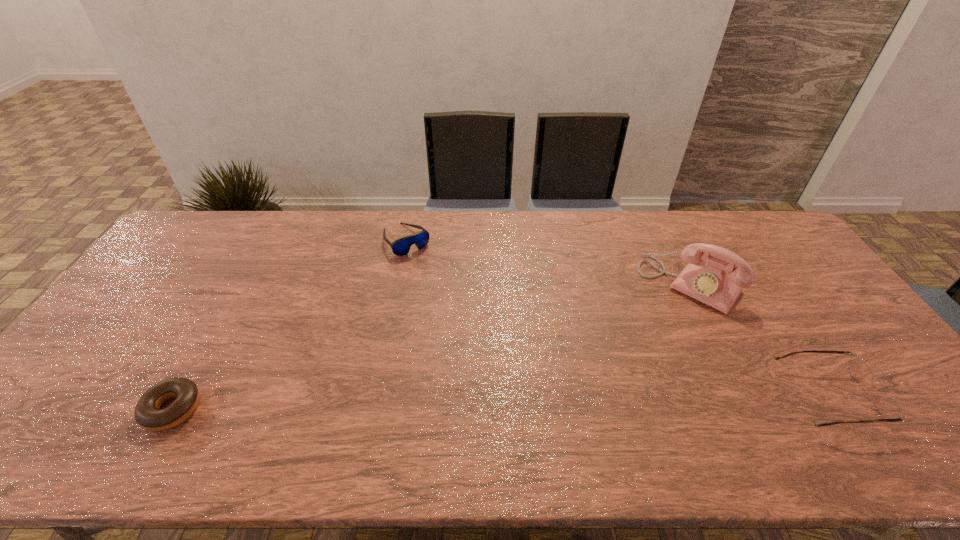
The width and height of the screenshot is (960, 540). Find the location of `vacant area at the left edge`. vacant area at the left edge is located at coordinates (108, 323).

Image resolution: width=960 pixels, height=540 pixels. I want to click on vacant space at the right edge of the desktop, so click(820, 340).

Locate an element on the screen. The height and width of the screenshot is (540, 960). free point between the spectacles and the telephone is located at coordinates (758, 341).

Find the location of a particular element. Image resolution: width=960 pixels, height=540 pixels. vacant area between the doughnut and the sunglasses is located at coordinates (289, 324).

This screenshot has width=960, height=540. Find the location of `free area in between the telephone and the sunglasses`. free area in between the telephone and the sunglasses is located at coordinates (548, 262).

Locate an element on the screen. The image size is (960, 540). vacant space that's between the spectacles and the telephone is located at coordinates (758, 341).

At what (x,y) coordinates should I click in order to perform the action: click on vacant region between the third object from right to left and the leftmost object. Please return your answer as a coordinate pair (x, y). Image resolution: width=960 pixels, height=540 pixels. Looking at the image, I should click on (289, 324).

Image resolution: width=960 pixels, height=540 pixels. I want to click on vacant space that's between the tallest object and the spectacles, so click(758, 341).

Where is `vacant area between the second object from left to right and the telephone`? This screenshot has width=960, height=540. vacant area between the second object from left to right and the telephone is located at coordinates (548, 262).

You are a GUI agent. You are given a task and a screenshot of the screen. Output one action in this format:
    pyautogui.click(x=<x>, y=<y>)
    Task: Click on the empty space between the leftmost object and the sunglasses
    The width and height of the screenshot is (960, 540).
    Given the screenshot: What is the action you would take?
    pyautogui.click(x=289, y=324)